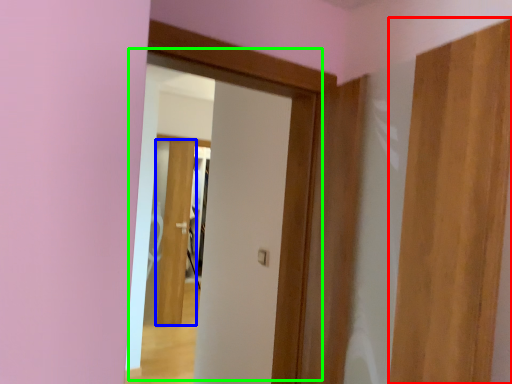
Question: Considering the real-world distances, which object is farthest from door (highlighted by a red box)? door (highlighted by a blue box) or door (highlighted by a green box)?

Choices:
 (A) door
 (B) door

Answer: (A)